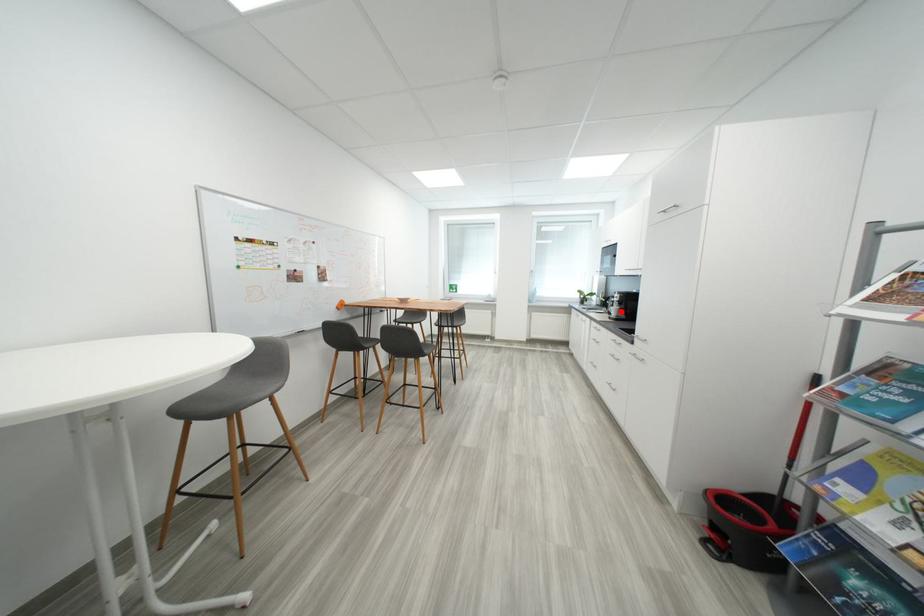
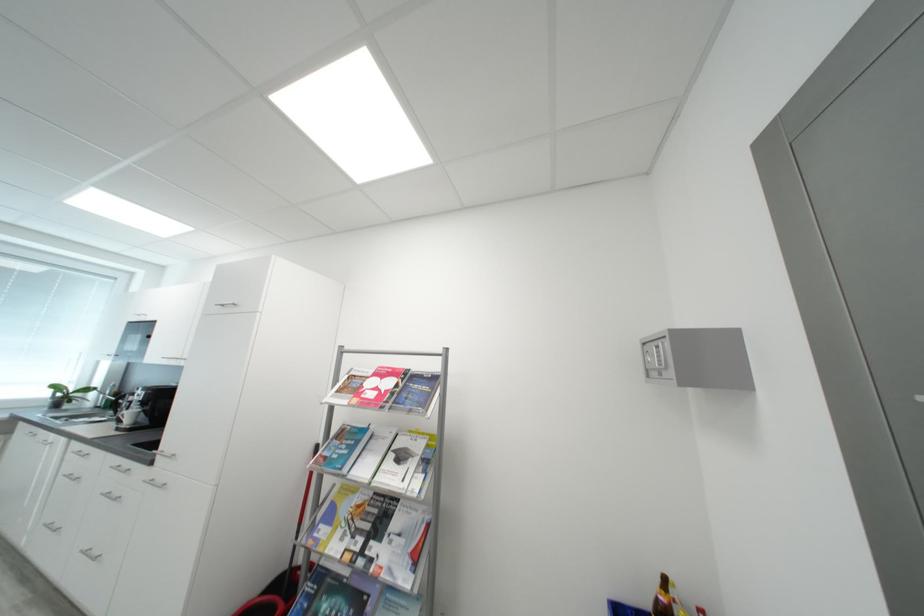
Find the pixel in the second image that matches the highlighted location in the first image.

(138, 416)